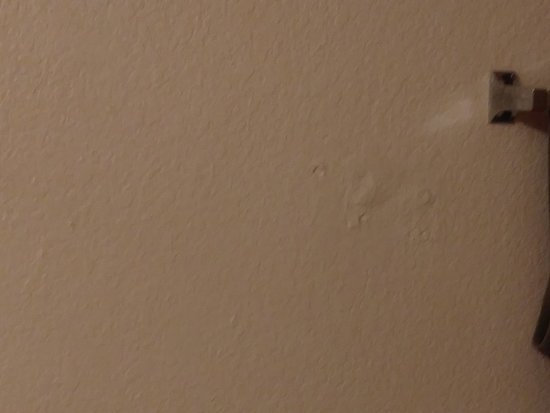
This screenshot has height=413, width=550. Identify the location of wall above towel rack. (526, 44).